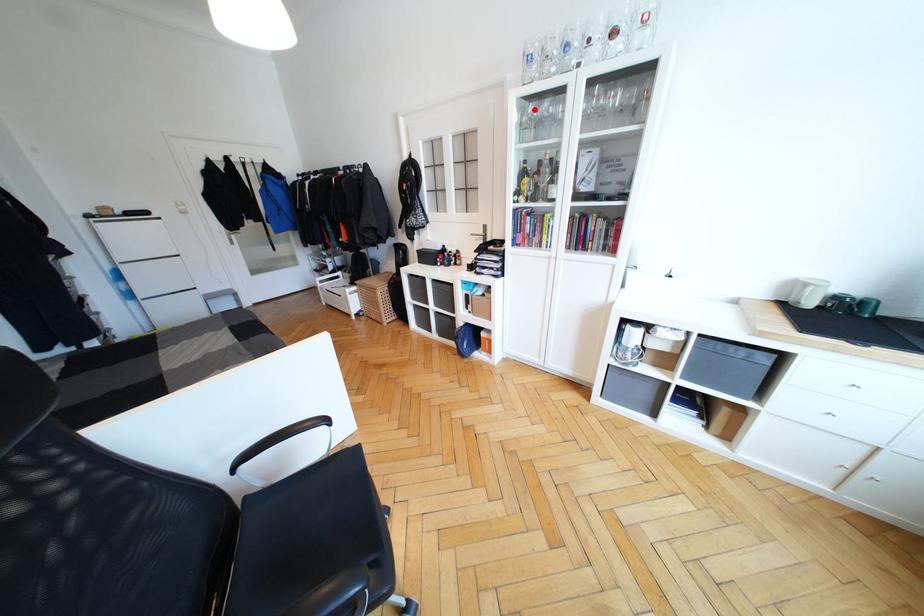
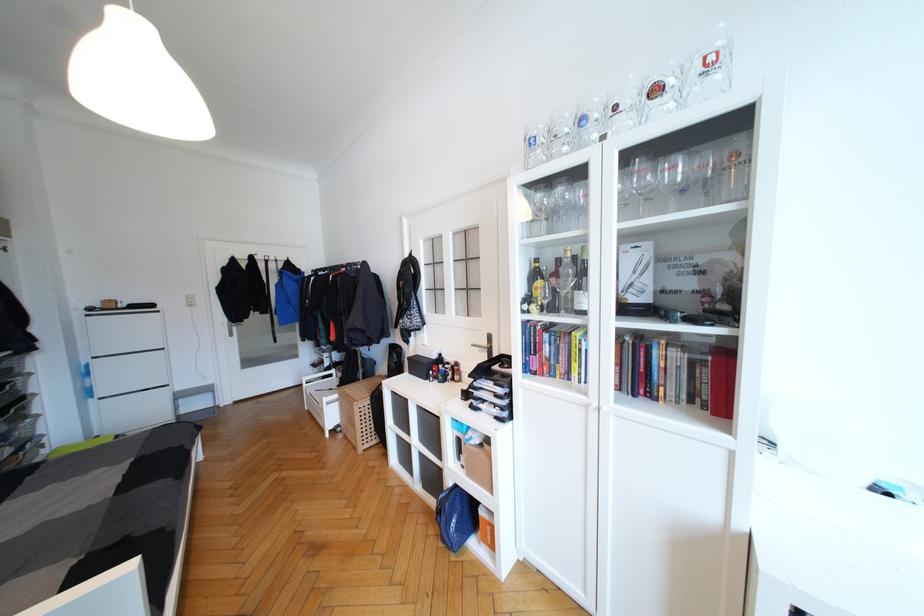
Question: A red point is marked in image1. In image2, is the corresponding 3D point closer to the camera or farther? Reply with the corresponding letter.

Choices:
 (A) The corresponding 3D point is closer.
 (B) The corresponding 3D point is farther.

Answer: (B)